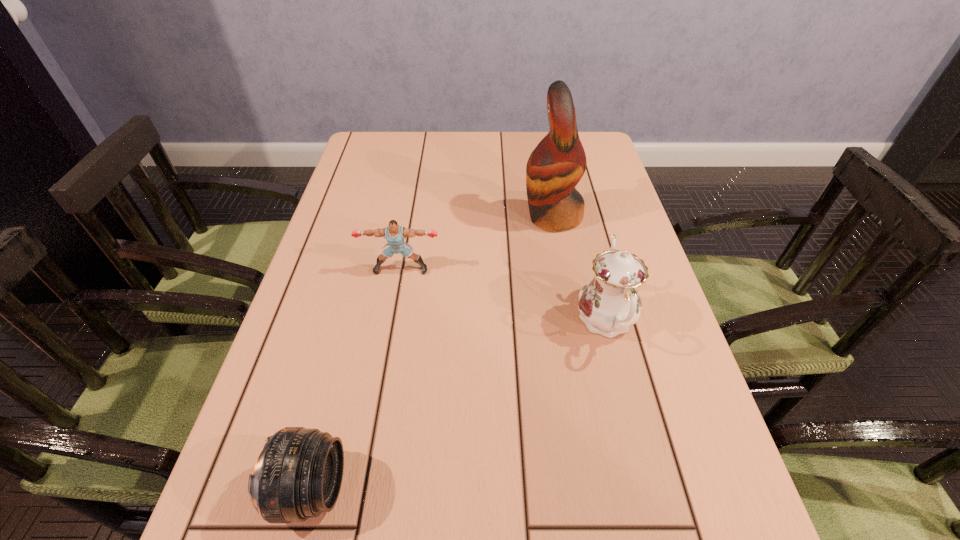
Find the location of `empty space between the second tallest object and the parrot`. empty space between the second tallest object and the parrot is located at coordinates (579, 269).

In order to click on vacant point located between the nearest object and the second nearest object in this screenshot , I will do `click(459, 404)`.

Where is `free space between the tallest object and the nearest object`? free space between the tallest object and the nearest object is located at coordinates (432, 353).

Locate an element on the screen. This screenshot has width=960, height=540. free point between the farthest object and the second nearest object is located at coordinates (579, 269).

This screenshot has height=540, width=960. I want to click on unoccupied position between the parrot and the nearest object, so click(432, 353).

I want to click on free space between the telephoto lens and the tallest object, so click(x=432, y=353).

Where is `free spot between the third farthest object and the second farthest object`? free spot between the third farthest object and the second farthest object is located at coordinates (503, 295).

I want to click on vacant region between the farthest object and the second nearest object, so [579, 269].

You are a GUI agent. You are given a task and a screenshot of the screen. Output one action in this format:
    pyautogui.click(x=<x>, y=<y>)
    Task: Click on the vacant space that's between the chinaware and the nearest object
    The image size is (960, 540).
    Given the screenshot: What is the action you would take?
    pyautogui.click(x=459, y=404)

The width and height of the screenshot is (960, 540). Find the location of `free space that is in between the parrot and the third nearest object`. free space that is in between the parrot and the third nearest object is located at coordinates (477, 243).